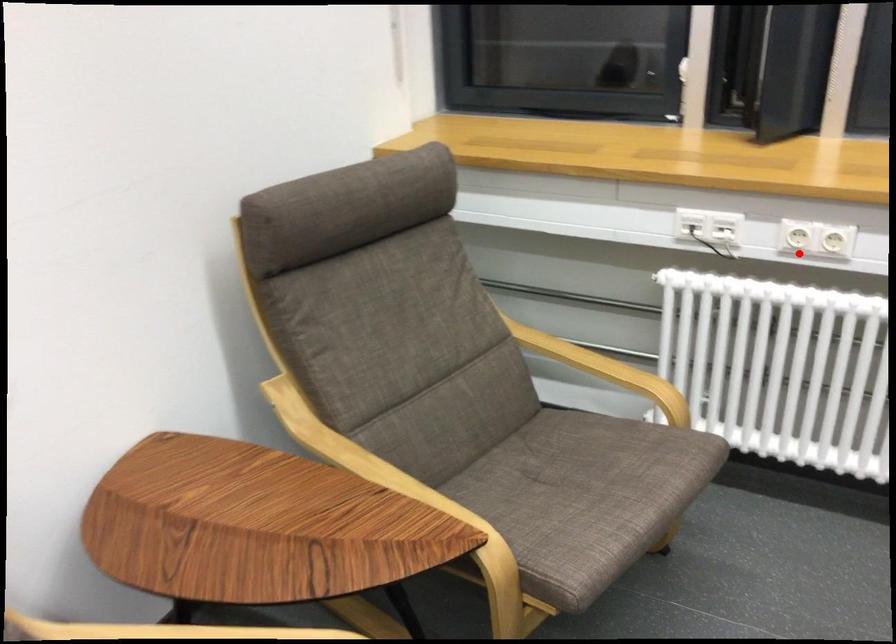
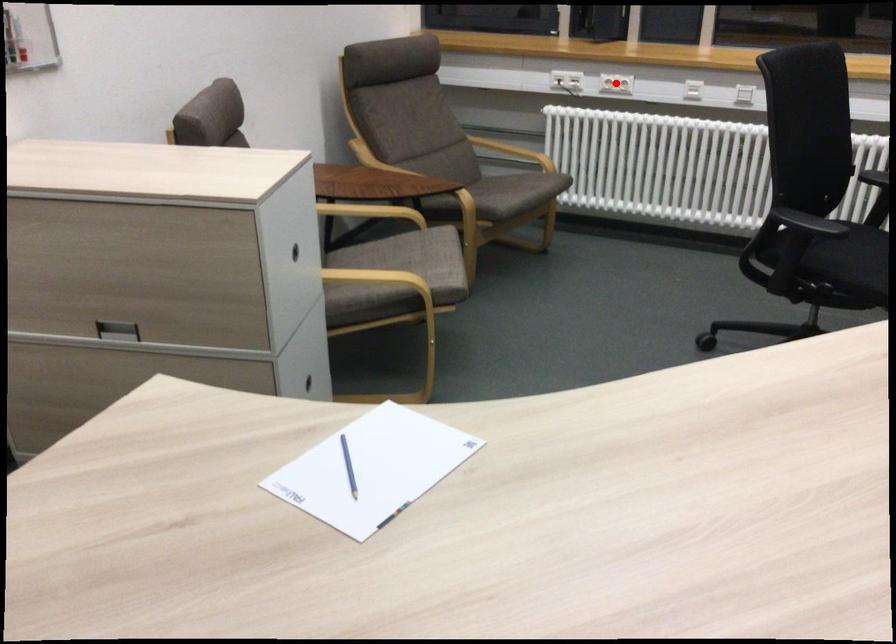
Consider the image. I am providing you with two images of the same scene from different viewpoints. A red point is marked on the first image and another point is marked on the second image. Is the red point in image1 aligned with the point shown in image2?

Yes